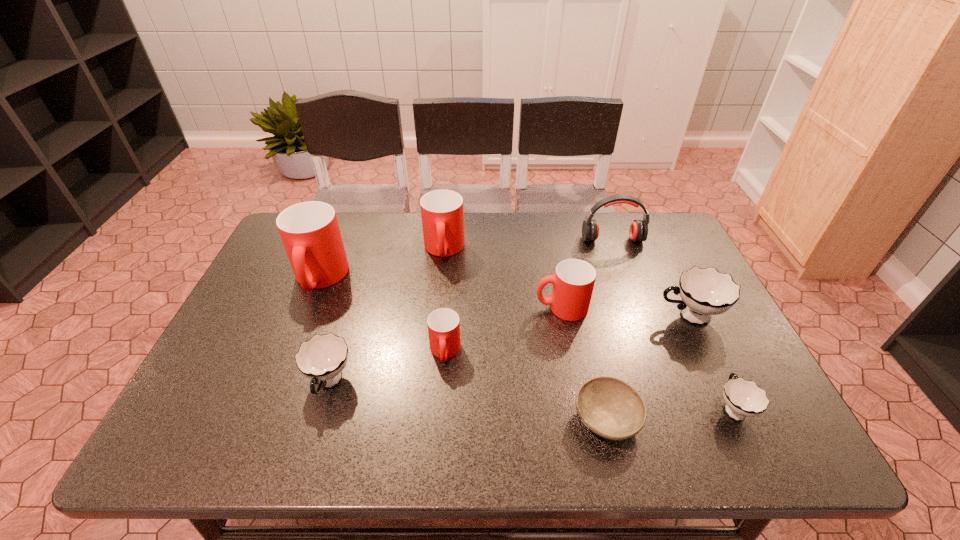
Find the location of a particular element. The image size is (960, 540). the biggest red cup is located at coordinates (310, 233).

Where is `the tallest cup`? This screenshot has width=960, height=540. the tallest cup is located at coordinates (310, 233).

I want to click on the second tallest cup, so (x=442, y=214).

Where is `earphone`? Image resolution: width=960 pixels, height=540 pixels. earphone is located at coordinates (638, 231).

The image size is (960, 540). In order to click on the third cup from right to left in this screenshot , I will do `click(573, 282)`.

Identify the location of the rightmost red cup. (573, 282).

This screenshot has height=540, width=960. I want to click on the farthest white cup, so click(704, 292).

Where is `the smallest red cup`? The height and width of the screenshot is (540, 960). the smallest red cup is located at coordinates click(x=443, y=324).

At what (x,y) coordinates should I click in order to perform the action: click on the leftmost white cup. Please return your answer as a coordinate pair (x, y). Image resolution: width=960 pixels, height=540 pixels. Looking at the image, I should click on (322, 358).

The height and width of the screenshot is (540, 960). Identify the location of the eighth tallest object. pyautogui.click(x=743, y=398).